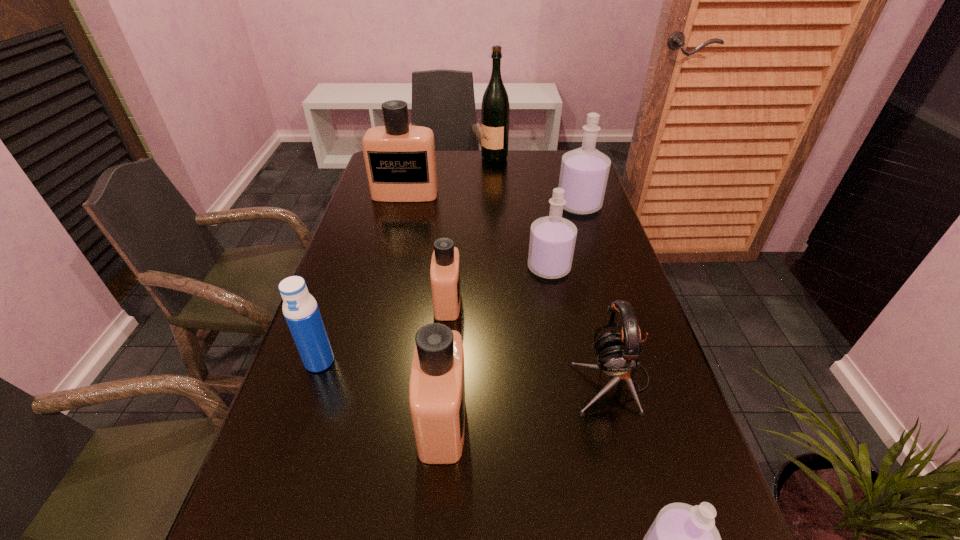
What are the coordinates of `blue water bottle` in the screenshot? It's located at (300, 309).

The height and width of the screenshot is (540, 960). I want to click on the smallest beige perfume, so click(445, 264).

Where is `the third nearest perfume`? The width and height of the screenshot is (960, 540). the third nearest perfume is located at coordinates (445, 264).

Locate an element on the screen. This screenshot has height=540, width=960. vacant space located on the front-facing side of the green liquor is located at coordinates (411, 157).

Find the location of a particular element. free space located on the front-facing side of the green liquor is located at coordinates 440,157.

I want to click on blank space located on the front-facing side of the green liquor, so click(x=423, y=157).

Image resolution: width=960 pixels, height=540 pixels. What are the coordinates of `vacant space situated 0.180m on the front label of the farthest beige perfume` in the screenshot? It's located at (396, 235).

You are a GUI agent. You are given a task and a screenshot of the screen. Output one action in this format:
    pyautogui.click(x=<x>, y=<y>)
    Task: Click on the free space located 0.050m on the back of the farthest purple perfume
    The width and height of the screenshot is (960, 540).
    Given the screenshot: What is the action you would take?
    573,186

Identify the location of vacant point located on the left of the third perfume from right to left. The image size is (960, 540). (475, 268).

I want to click on free space located on the front label of the nearest beige perfume, so click(496, 421).